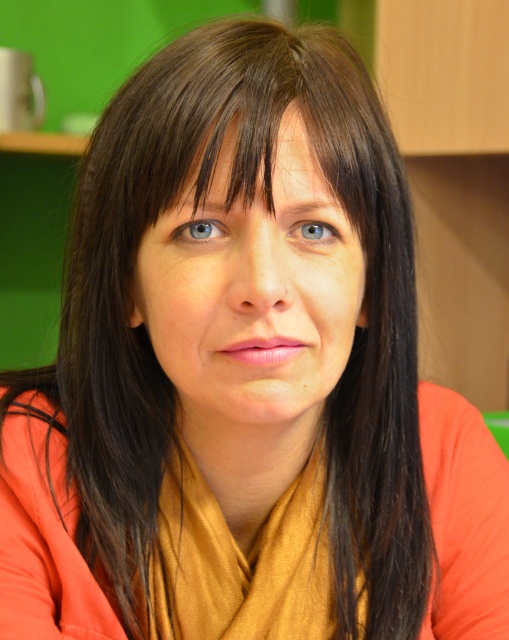
Question: Among these objects, which one is nearest to the camera?

Choices:
 (A) blue glossy eye at upper center
 (B) smooth skin face at center
 (C) blue glossy eye at center

Answer: (B)

Question: Which object is closer to the camera taking this photo?

Choices:
 (A) blue glossy eye at center
 (B) blue glossy eye at upper center
 (C) smooth skin face at center

Answer: (C)

Question: Which object appears farthest from the camera in this image?

Choices:
 (A) blue glossy eye at upper center
 (B) smooth skin face at center

Answer: (A)

Question: Can you confirm if smooth skin face at center is thinner than blue glossy eye at upper center?

Choices:
 (A) yes
 (B) no

Answer: (B)

Question: Does blue glossy eye at upper center appear on the right side of blue glossy eye at center?

Choices:
 (A) no
 (B) yes

Answer: (A)

Question: Observing the image, what is the correct spatial positioning of smooth skin face at center in reference to blue glossy eye at upper center?

Choices:
 (A) left
 (B) right

Answer: (B)